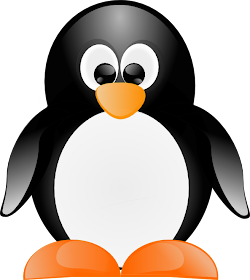
Locate an element on the screen. The width and height of the screenshot is (250, 280). white fur is located at coordinates (101, 208).